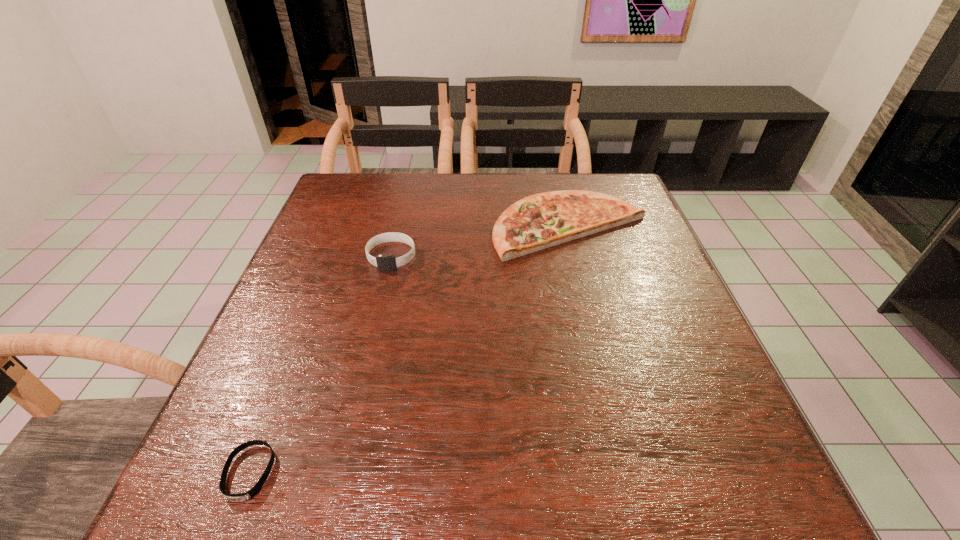
What are the coordinates of `object at the right edge` in the screenshot? It's located at (543, 220).

The width and height of the screenshot is (960, 540). Identify the location of object situated at the near left corner. (254, 491).

You are a GUI agent. You are given a task and a screenshot of the screen. Output one action in this format:
    pyautogui.click(x=<x>, y=<y>)
    Task: Click on the object that is at the far right corner
    Image resolution: width=960 pixels, height=540 pixels.
    Given the screenshot: What is the action you would take?
    coord(543,220)

The width and height of the screenshot is (960, 540). In the image, there is a desktop. Identify the location of vacant space at the far edge. (x=522, y=194).

Where is `free region at the near edge of the desktop`? The image size is (960, 540). free region at the near edge of the desktop is located at coordinates (457, 477).

Image resolution: width=960 pixels, height=540 pixels. Find the location of `vacant area at the left edge`. vacant area at the left edge is located at coordinates (333, 329).

The height and width of the screenshot is (540, 960). What are the coordinates of `vacant space at the right edge` in the screenshot? It's located at (630, 348).

In the image, there is a desktop. Where is `vacant space at the far left corner`? Image resolution: width=960 pixels, height=540 pixels. vacant space at the far left corner is located at coordinates (373, 192).

The image size is (960, 540). Find the location of `blank area at the far right corner`. blank area at the far right corner is located at coordinates (609, 185).

Identify the location of blank region between the rightmost object and the right wristband. This screenshot has width=960, height=540. (481, 241).